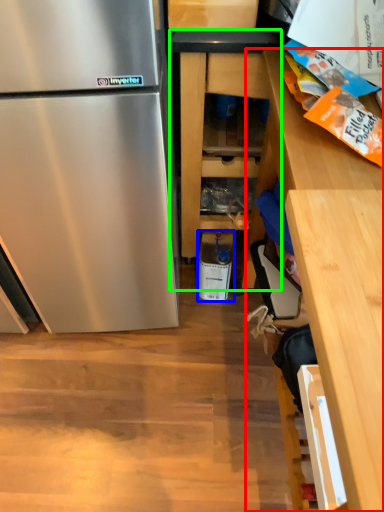
Question: Based on their relative distances, which object is farther from cabinetry (highlighted by a red box)? Choose from appliance (highlighted by a blue box) and cabinetry (highlighted by a green box).

Choices:
 (A) appliance
 (B) cabinetry

Answer: (A)